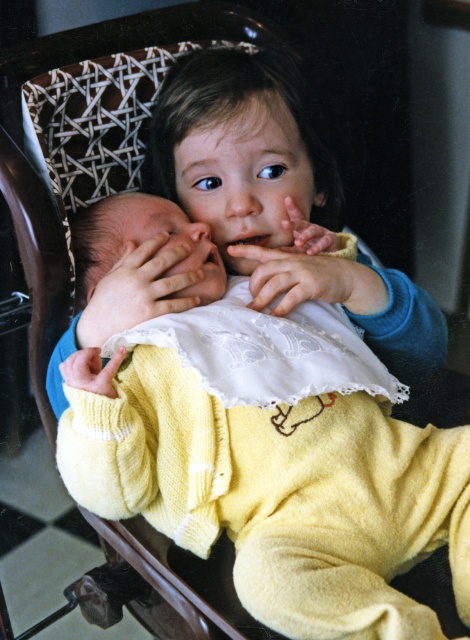
In the scene shown: Between yellow knitted sweater at center and smooth skin hand at center, which one is positioned lower?

yellow knitted sweater at center is below.

Is point (146, 516) farther from viewer compared to point (132, 284)?

That is False.

Where is `yellow knitted sweater at center`? The height and width of the screenshot is (640, 470). yellow knitted sweater at center is located at coordinates (264, 445).